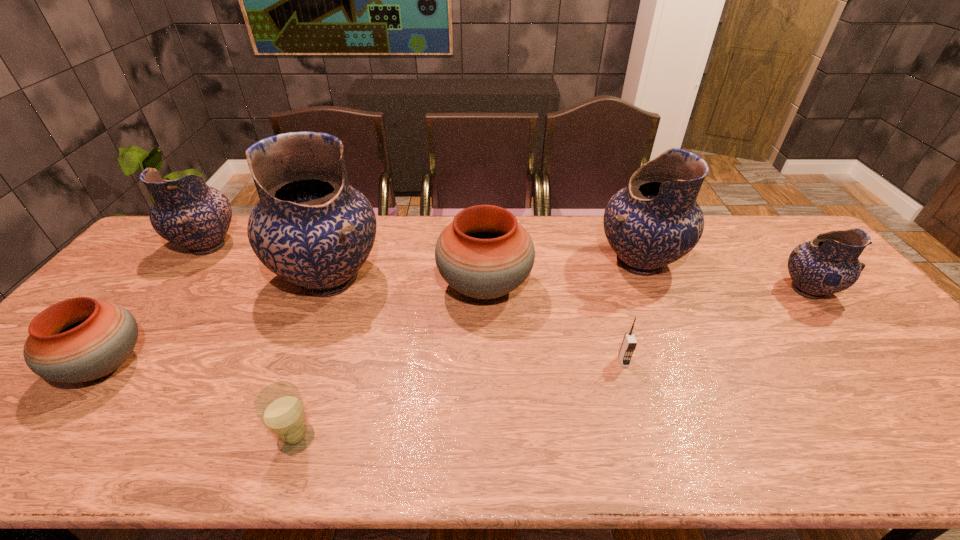
Where is `pottery that is the second closest to the nearest pottery`? The image size is (960, 540). pottery that is the second closest to the nearest pottery is located at coordinates (187, 212).

Select which pottery appears as the fourth closest to the rightmost pottery. Please provide its 2D coordinates. Your answer should be formatted as a tuple, i.e. [(x, y)], where the tuple contains the x and y coordinates of a point satisfying the conditions above.

[(187, 212)]

The width and height of the screenshot is (960, 540). Find the location of `blue pottery object that ranks as the third closest to the farther red pottery`. blue pottery object that ranks as the third closest to the farther red pottery is located at coordinates (187, 212).

Point out which blue pottery is positioned as the third nearest to the third tallest pottery. Please provide its 2D coordinates. Your answer should be formatted as a tuple, i.e. [(x, y)], where the tuple contains the x and y coordinates of a point satisfying the conditions above.

[(828, 264)]

Identify the location of free region that satisfies the following two spatial constraints: 1. on the back side of the smallest blue pottery; 2. on the right side of the nearest pottery. This screenshot has width=960, height=540. (165, 290).